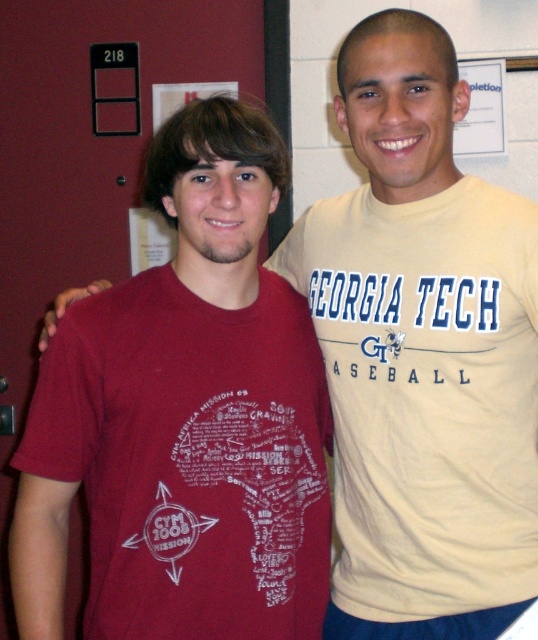
Who is positioned more to the right, matte red t-shirt at left or light yellow cotton t-shirt at right?

light yellow cotton t-shirt at right is more to the right.

Between point (211, 577) and point (529, 250), which one is positioned behind?

Point (529, 250)

The height and width of the screenshot is (640, 538). Identify the location of matte red t-shirt at left. (186, 419).